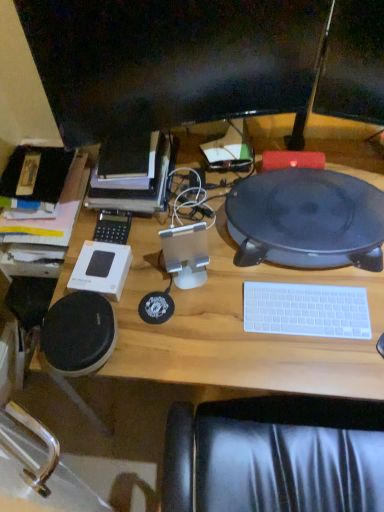
Image resolution: width=384 pixels, height=512 pixels. Describe the element at coordinates (113, 227) in the screenshot. I see `black plastic calculator at center-left` at that location.

Identify the location of white plastic keyboard at lower right. This screenshot has width=384, height=512. (306, 310).

The image size is (384, 512). Find the location of `black plastic calculator at center-left`. black plastic calculator at center-left is located at coordinates [113, 227].

From the image's perspective, between black glossy monitor at upper center and white plastic keyboard at lower right, who is located below?

white plastic keyboard at lower right.

Is black glossy monitor at upper center to the left of white plastic keyboard at lower right from the viewer's perspective?

Yes, black glossy monitor at upper center is to the left of white plastic keyboard at lower right.

Does black glossy monitor at upper center have a greater width compared to white plastic keyboard at lower right?

Incorrect, the width of black glossy monitor at upper center does not surpass that of white plastic keyboard at lower right.

Where is `computer keyboard behind the black glossy monitor at upper center`? computer keyboard behind the black glossy monitor at upper center is located at coordinates (306, 310).

Measure the distance between black glossy monitor at upper center and hardcover book at upper left.

A distance of 11.20 inches exists between black glossy monitor at upper center and hardcover book at upper left.

From a real-world perspective, is black glossy monitor at upper center physically below hardcover book at upper left?

No, from a real-world perspective, black glossy monitor at upper center is not beneath hardcover book at upper left.

Which point is more distant from viewer, (186, 45) or (122, 198)?

The point (122, 198) is more distant.

Is black glossy monitor at upper center not near hardcover book at upper left?

No, black glossy monitor at upper center is in close proximity to hardcover book at upper left.

From the picture: From a real-world perspective, which object rests below the other?

white plastic keyboard at lower right.

Is white plastic keyboard at lower right turned away from black glossy monitor at upper center?

white plastic keyboard at lower right is not turned away from black glossy monitor at upper center.

Considering the relative sizes of white plastic keyboard at lower right and black glossy monitor at upper center in the image provided, is white plastic keyboard at lower right shorter than black glossy monitor at upper center?

Indeed, white plastic keyboard at lower right has a lesser height compared to black glossy monitor at upper center.

Is hardcover book at upper left bigger or smaller than black glossy monitor at upper center?

In the image, hardcover book at upper left appears to be larger than black glossy monitor at upper center.

Considering the positions of objects hardcover book at upper left and black glossy monitor at upper center in the image provided, who is more to the right, hardcover book at upper left or black glossy monitor at upper center?

Positioned to the right is black glossy monitor at upper center.

From the picture: Which object is further away from the camera taking this photo, hardcover book at upper left or black glossy monitor at upper center?

Positioned behind is hardcover book at upper left.

Based on the photo, from the image's perspective, is black glossy monitor at upper center located beneath matte black tablet at center?

No, from the image's perspective, black glossy monitor at upper center is not beneath matte black tablet at center.

Would you consider black glossy monitor at upper center to be distant from matte black tablet at center?

black glossy monitor at upper center is actually quite close to matte black tablet at center.

Between black glossy monitor at upper center and matte black tablet at center, which one has smaller size?

With smaller size is black glossy monitor at upper center.

From a real-world perspective, is black glossy monitor at upper center physically located above or below matte black tablet at center?

From a real-world perspective, black glossy monitor at upper center is physically above matte black tablet at center.

Is hardcover book at upper left situated inside white plastic keyboard at lower right or outside?

hardcover book at upper left is outside white plastic keyboard at lower right.

Which is nearer, [90,198] or [324,324]?

Positioned in front is point [324,324].

Which object is closer to the camera, hardcover book at upper left or white plastic keyboard at lower right?

white plastic keyboard at lower right is closer to the camera.

Identify the location of computer keyboard on the right side of hardcover book at upper left. (306, 310).

Who is smaller, white plastic keyboard at lower right or black plastic calculator at center-left?

Smaller between the two is black plastic calculator at center-left.

From a real-world perspective, is white plastic keyboard at lower right on black plastic calculator at center-left?

No, from a real-world perspective, white plastic keyboard at lower right is not on top of black plastic calculator at center-left.

Can you confirm if white plastic keyboard at lower right is positioned to the right of black plastic calculator at center-left?

Yes.

At what (x,y) coordinates should I click in order to perform the action: click on computer keyboard that appears below the black glossy monitor at upper center (from the image's perspective). Please return your answer as a coordinate pair (x, y). Looking at the image, I should click on (306, 310).

Where is `book behind the black glossy monitor at upper center`? book behind the black glossy monitor at upper center is located at coordinates (x=138, y=190).

Looking at the image, which one is located further to matte black tablet at center, white plastic keyboard at lower right or black plastic calculator at center-left?

black plastic calculator at center-left is further to matte black tablet at center.

Considering their positions, is black glossy monitor at upper center positioned further to matte black tablet at center than white plastic keyboard at lower right?

black glossy monitor at upper center is further to matte black tablet at center.

Which object lies nearer to the anchor point white plastic keyboard at lower right, hardcover book at upper left or black plastic calculator at center-left?

hardcover book at upper left is positioned closer to the anchor white plastic keyboard at lower right.

Estimate the real-world distances between objects in this image. Which object is closer to black plastic calculator at center-left, white plastic keyboard at lower right or hardcover book at upper left?

Among the two, hardcover book at upper left is located nearer to black plastic calculator at center-left.

Considering their positions, is hardcover book at upper left positioned closer to white plastic keyboard at lower right than matte black tablet at center?

matte black tablet at center is closer to white plastic keyboard at lower right.

Estimate the real-world distances between objects in this image. Which object is further from matte black tablet at center, black plastic calculator at center-left or hardcover book at upper left?

The object further to matte black tablet at center is black plastic calculator at center-left.

Based on their spatial positions, is black glossy monitor at upper center or matte black tablet at center further from white plastic keyboard at lower right?

The object further to white plastic keyboard at lower right is black glossy monitor at upper center.

Looking at the image, which one is located closer to hardcover book at upper left, black glossy monitor at upper center or black plastic calculator at center-left?

black plastic calculator at center-left is closer to hardcover book at upper left.

At what (x,y) coordinates should I click in order to perform the action: click on tablet computer between black glossy monitor at upper center and white plastic keyboard at lower right from top to bottom. Please return your answer as a coordinate pair (x, y). The height and width of the screenshot is (512, 384). Looking at the image, I should click on (307, 217).

Identify the location of computer keyboard between black plastic calculator at center-left and matte black tablet at center in the horizontal direction. The width and height of the screenshot is (384, 512). (306, 310).

You are a GUI agent. You are given a task and a screenshot of the screen. Output one action in this format:
    pyautogui.click(x=<x>, y=<y>)
    Task: Click on the book between black glossy monitor at upper center and white plastic keyboard at lower right in the vertical direction
    This screenshot has width=384, height=512.
    Given the screenshot: What is the action you would take?
    click(x=138, y=190)

At what (x,y) coordinates should I click in order to perform the action: click on book situated between black plastic calculator at center-left and matte black tablet at center from left to right. Please return your answer as a coordinate pair (x, y). The height and width of the screenshot is (512, 384). Looking at the image, I should click on pyautogui.click(x=138, y=190).